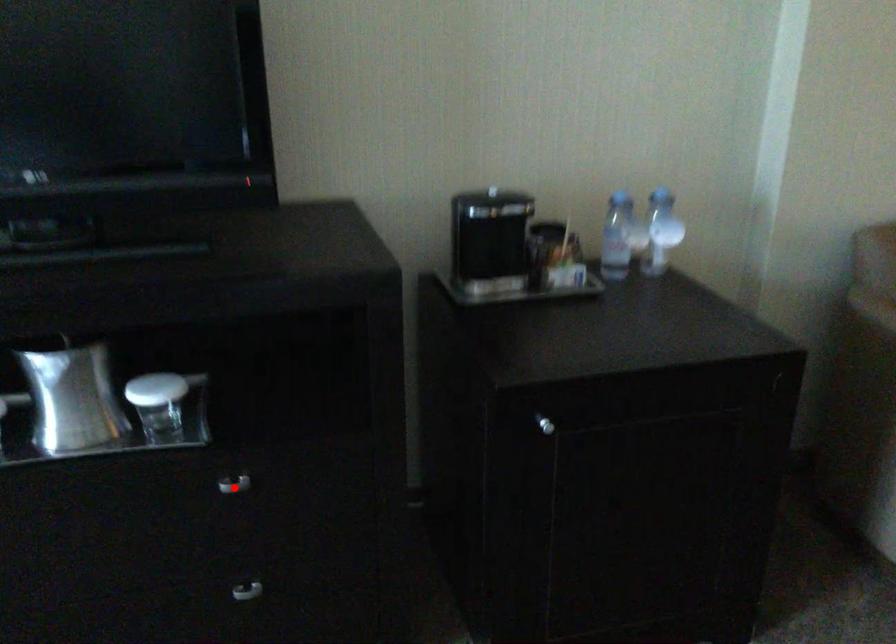
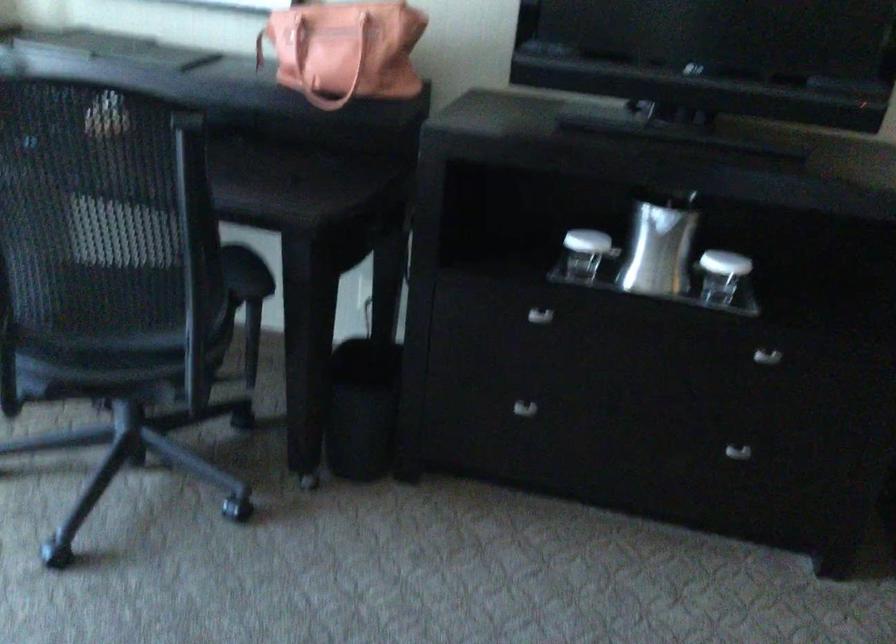
Find the pixel in the second image that matches the highlighted location in the first image.

(767, 357)